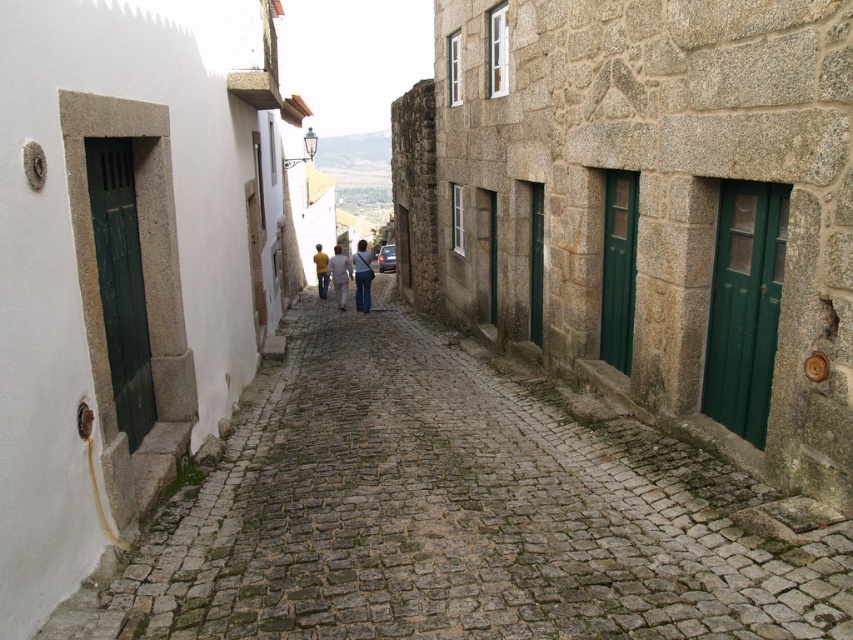
Is light yellow sweater at center bigger than yellow matte shirt at center?

Correct, light yellow sweater at center is larger in size than yellow matte shirt at center.

Who is taller, light yellow sweater at center or yellow matte shirt at center?

light yellow sweater at center

Between point (328, 266) and point (322, 298), which one is positioned behind?

The point (322, 298) is behind.

Identify the location of light yellow sweater at center. (339, 275).

Can you confirm if denim pants at center is positioned above light yellow sweater at center?

Correct, denim pants at center is located above light yellow sweater at center.

Is point (357, 256) closer to viewer compared to point (339, 269)?

Yes, point (357, 256) is in front of point (339, 269).

Is point (363, 244) closer to camera compared to point (341, 260)?

No, it is not.

You are a GUI agent. You are given a task and a screenshot of the screen. Output one action in this format:
    pyautogui.click(x=<x>, y=<y>)
    Task: Click on the denim pants at center
    The width and height of the screenshot is (853, 640).
    Given the screenshot: What is the action you would take?
    pyautogui.click(x=363, y=276)

Is brown cobblestone path at center below denim pants at center?

Correct, brown cobblestone path at center is located below denim pants at center.

How much distance is there between brown cobblestone path at center and denim pants at center?

brown cobblestone path at center is 12.36 meters away from denim pants at center.

Who is more forward, (519, 518) or (357, 304)?

Point (519, 518) is more forward.

In order to click on brown cobblestone path at center in this screenshot , I will do `click(454, 515)`.